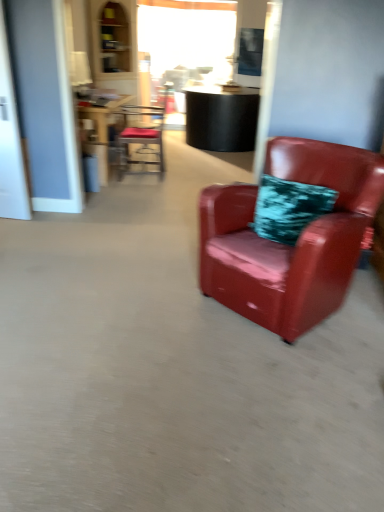
The image size is (384, 512). Find the location of `vacant area in front of glossy leather armchair at right, which is the 2th chair in left-to-right order`. vacant area in front of glossy leather armchair at right, which is the 2th chair in left-to-right order is located at coordinates (277, 383).